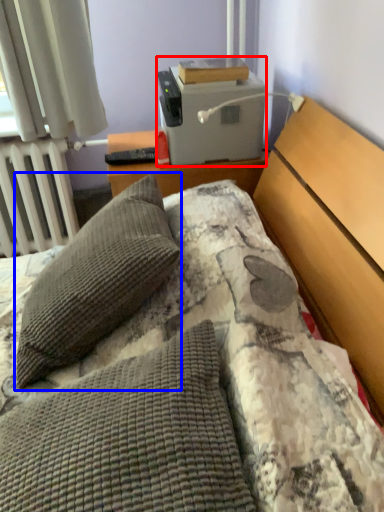
Question: Which object appears farthest to the camera in this image, printer (highlighted by a red box) or pillow (highlighted by a blue box)?

Choices:
 (A) printer
 (B) pillow

Answer: (A)